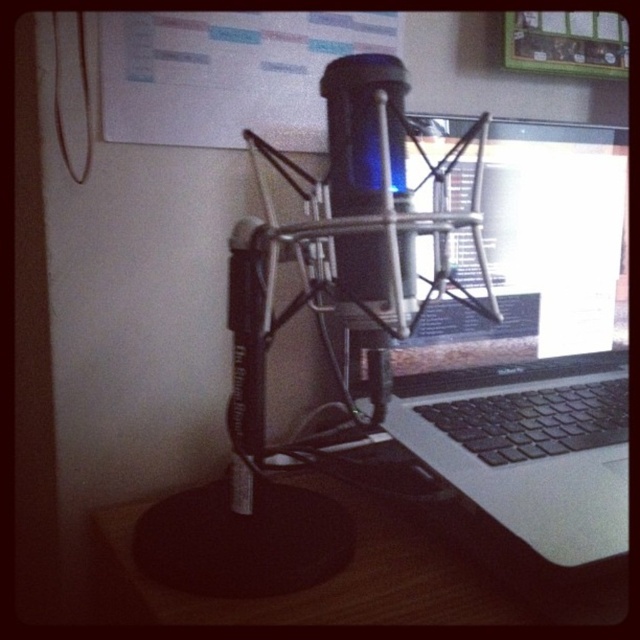
You are setting up a podcast recording station and need to place a small decorative item between the sleek silver laptop at center and the blue translucent microphone at center. Given their sizes, which object should the decorative item be placed closer to?

The sleek silver laptop at center is bigger than the blue translucent microphone at center, so the decorative item should be placed closer to the blue translucent microphone at center to ensure adequate space around the larger laptop.

You are setting up a home studio and want to place a new monitor speaker between the sleek silver laptop at center and the wooden table at center. Can you do this based on their current positions?

The sleek silver laptop at center is positioned over wooden table at center, so there is no space between them to place a monitor speaker between them.